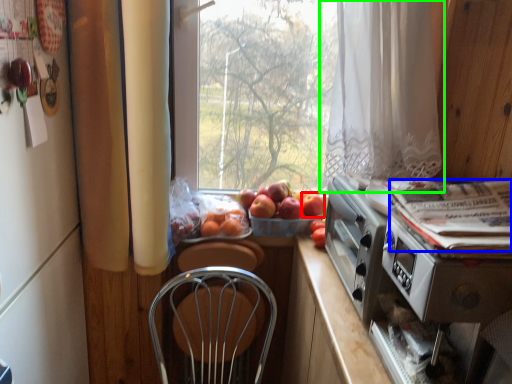
Question: Considering the real-world distances, which object is farthest from apple (highlighted by a red box)? magazine (highlighted by a blue box) or curtain (highlighted by a green box)?

Choices:
 (A) magazine
 (B) curtain

Answer: (A)